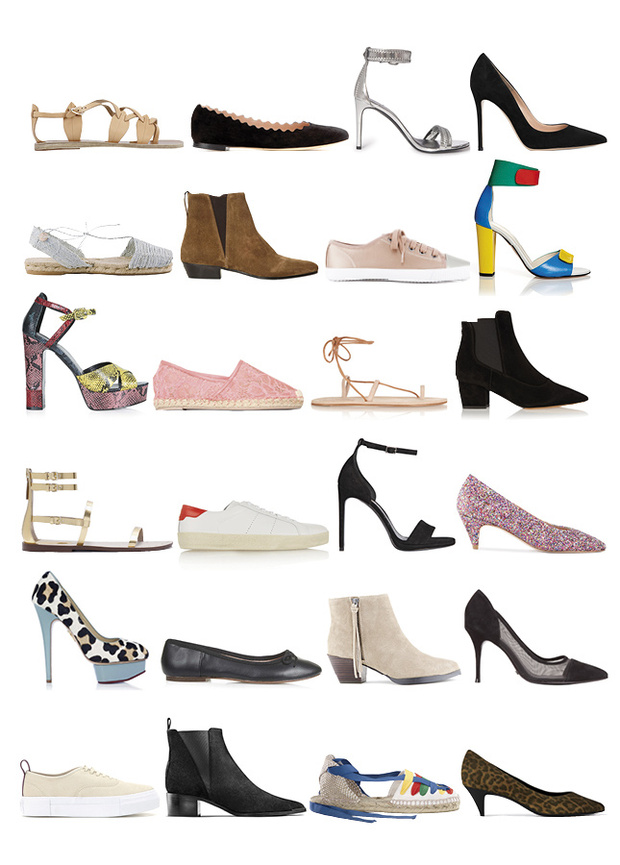
You are a GUI agent. You are given a task and a screenshot of the screen. Output one action in this format:
    pyautogui.click(x=<x>, y=<y>)
    Task: Click on the shoe insides
    This screenshot has height=865, width=620.
    Given the screenshot: What is the action you would take?
    pyautogui.click(x=113, y=260), pyautogui.click(x=43, y=336), pyautogui.click(x=387, y=400), pyautogui.click(x=532, y=123), pyautogui.click(x=427, y=144), pyautogui.click(x=577, y=272), pyautogui.click(x=397, y=537), pyautogui.click(x=151, y=541)